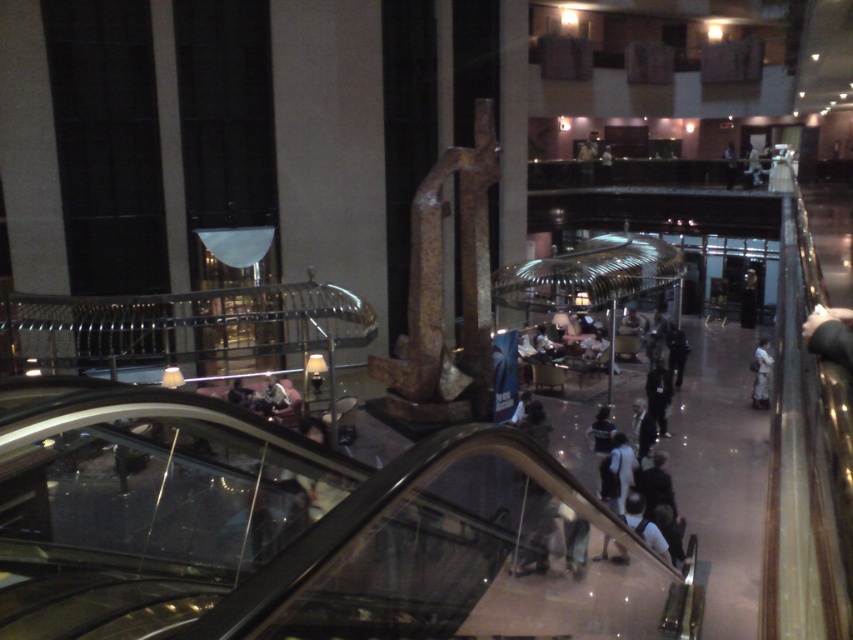
Does point (761, 353) lie behind point (234, 396)?

Yes, point (761, 353) is farther from viewer.

Which is behind, point (758, 390) or point (241, 397)?

Positioned behind is point (758, 390).

Does point (761, 380) come in front of point (242, 392)?

No, it is behind (242, 392).

Where is `white fabric bag at lower right`? white fabric bag at lower right is located at coordinates (761, 374).

Looking at this image, how far apart are white fabric person at lower right and dark gray fabric pants at lower right?

white fabric person at lower right is 4.63 meters from dark gray fabric pants at lower right.

Find the location of a particular element. The image size is (853, 640). white fabric person at lower right is located at coordinates (643, 524).

Can you confirm if dark gray fabric pants at lower right is smaller than dark gray fabric pants at center?

No, dark gray fabric pants at lower right is not smaller than dark gray fabric pants at center.

Who is more distant from viewer, (660, 364) or (654, 440)?

Point (660, 364)

I want to click on dark gray fabric pants at lower right, so click(659, 394).